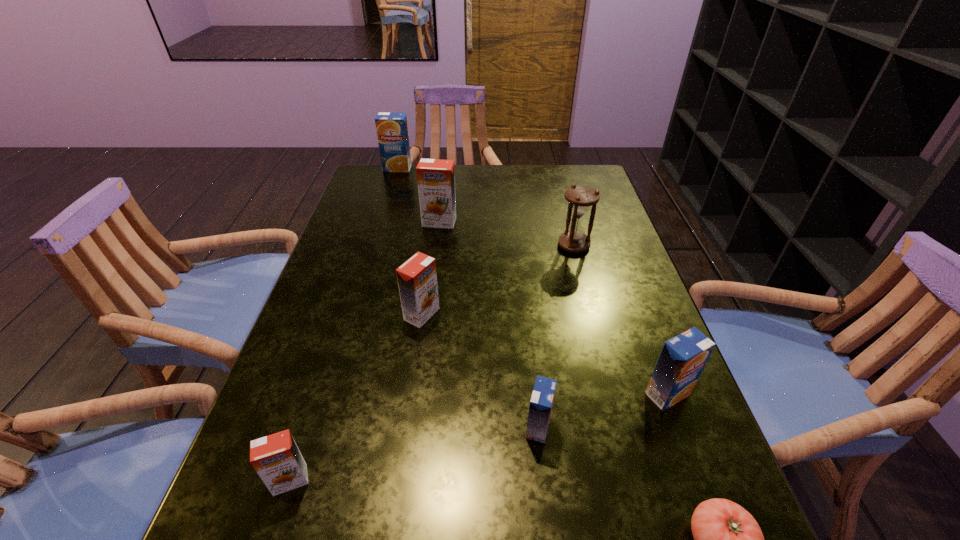
Locate an element on the screen. The width and height of the screenshot is (960, 540). free region located 0.390m on the right of the second nearest object is located at coordinates (554, 480).

This screenshot has width=960, height=540. What are the coordinates of `object that is at the far edge` in the screenshot? It's located at (392, 131).

The image size is (960, 540). Find the location of `hourglass situated at the right edge`. hourglass situated at the right edge is located at coordinates (580, 197).

The height and width of the screenshot is (540, 960). Find the location of `orange_juice that is at the right edge`. orange_juice that is at the right edge is located at coordinates (683, 358).

Image resolution: width=960 pixels, height=540 pixels. I want to click on object that is at the far left corner, so (392, 131).

In the image, there is a desktop. At what (x,y) coordinates should I click in order to perform the action: click on free space at the far edge. Please return your answer as a coordinate pair (x, y). Looking at the image, I should click on (488, 183).

At what (x,y) coordinates should I click in order to perform the action: click on vacant space at the left edge of the desktop. Please return your answer as a coordinate pair (x, y). Looking at the image, I should click on (367, 282).

The image size is (960, 540). I want to click on vacant point at the right edge, so click(701, 496).

In the image, there is a desktop. Identify the location of vacant region at the far left corner. This screenshot has height=540, width=960. (391, 187).

I want to click on vacant area that lies between the fourth nearest orange juice and the nearest orange juice, so click(356, 397).